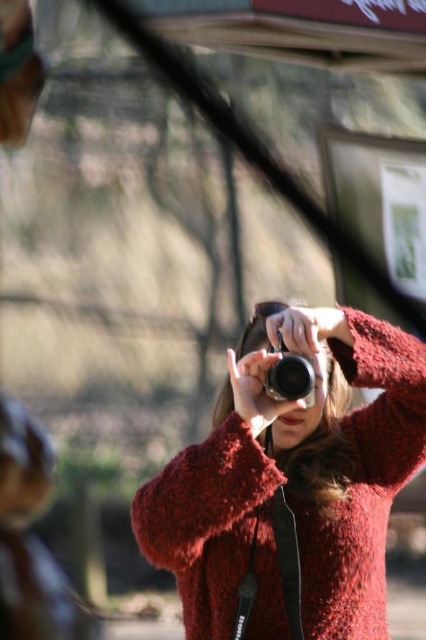
Question: Can you confirm if fuzzy red sweater at center is thinner than matte black camera at center?

Choices:
 (A) no
 (B) yes

Answer: (A)

Question: Among these points, which one is farthest from the camera?

Choices:
 (A) (373, 364)
 (B) (276, 332)

Answer: (A)

Question: Does fuzzy red sweater at center appear under matte black camera at center?

Choices:
 (A) yes
 (B) no

Answer: (A)

Question: Does fuzzy red sweater at center have a smaller size compared to matte black camera at center?

Choices:
 (A) yes
 (B) no

Answer: (B)